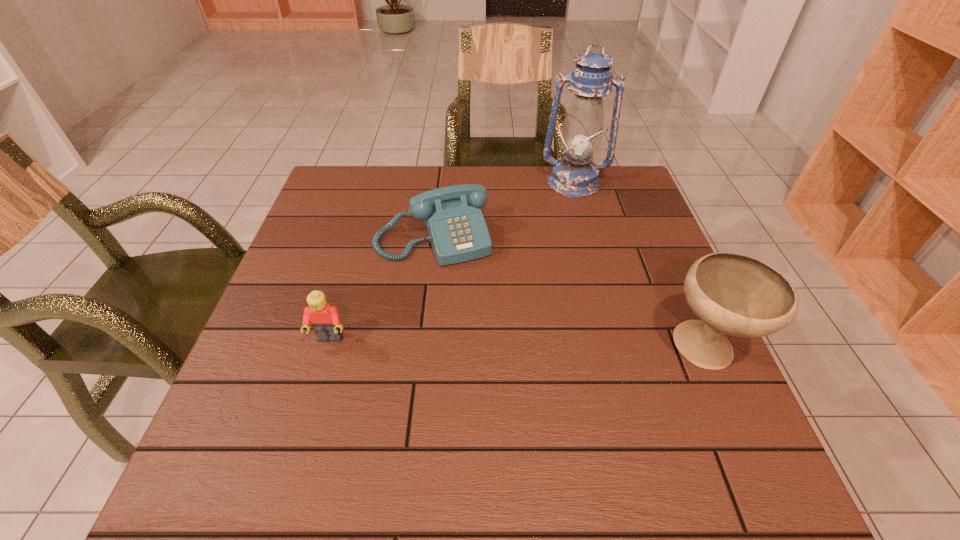
You are a GUI agent. You are given a task and a screenshot of the screen. Output one action in this format:
    pyautogui.click(x=<x>, y=<y>)
    Task: Click on the Lego
    This screenshot has width=960, height=540.
    Given the screenshot: What is the action you would take?
    [325, 320]

Image resolution: width=960 pixels, height=540 pixels. I want to click on chalice, so pyautogui.click(x=735, y=294).

The height and width of the screenshot is (540, 960). Find the location of `the third nearest object`. the third nearest object is located at coordinates (457, 231).

The image size is (960, 540). Identify the location of the tallest object. (575, 175).

This screenshot has width=960, height=540. What are the coordinates of `the farthest object` in the screenshot? It's located at (575, 175).

At what (x,y) coordinates should I click in order to perform the action: click on vacant space situated 0.100m on the face of the Lego. Please return your answer as a coordinate pair (x, y). Looking at the image, I should click on (314, 393).

Find the location of a particular element. The height and width of the screenshot is (540, 960). vacant space located 0.050m on the back of the chalice is located at coordinates (683, 298).

You are a GUI agent. You are given a task and a screenshot of the screen. Output one action in this format:
    pyautogui.click(x=<x>, y=<y>)
    Task: Click on the vacant space located on the dial of the telephone
    This screenshot has height=540, width=960.
    Given the screenshot: What is the action you would take?
    pyautogui.click(x=483, y=352)

The image size is (960, 540). In order to click on free space located 0.370m on the dial of the telephone in this screenshot , I will do `click(502, 400)`.

Image resolution: width=960 pixels, height=540 pixels. Find the location of `vacant space located 0.260m on the dial of the telephone`. vacant space located 0.260m on the dial of the telephone is located at coordinates (483, 352).